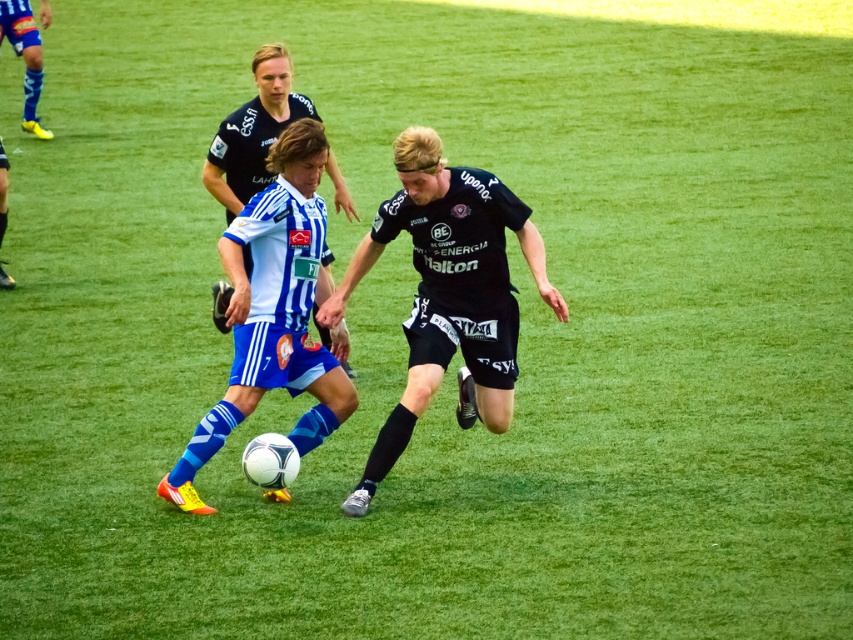
What are the coordinates of the white matte soccer ball at center?

The white matte soccer ball at center is located at point (350, 291).

You are a referee in a soccer match. You see two soccer balls on the field, a white matte soccer ball at center and a blue matte soccer ball at center. The rules state that only one ball should be used during a match. Which ball should you choose to ensure compliance with the rules?

You should choose either the white matte soccer ball at center or the blue matte soccer ball at center, but since there are two balls present, you need to remove one to comply with the rule requiring only one ball per match.